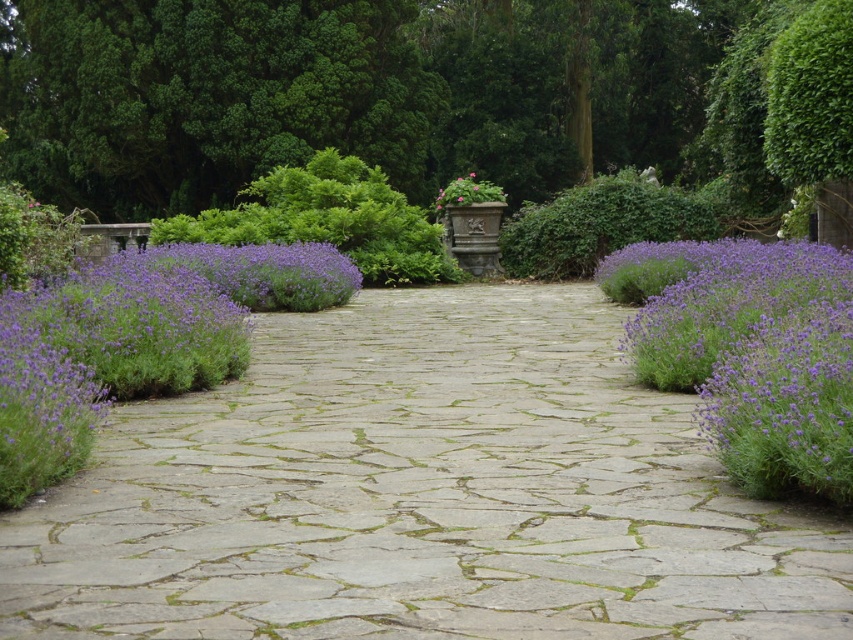
You are a gardener who needs to place a new decorative item along the garden path. The natural stone path at center and the pink matte flower pot at center are both in your view. Which object is shorter in height?

The natural stone path at center is not as tall as the pink matte flower pot at center, so the natural stone path at center is shorter in height.

From the picture: You are a gardener planning to walk along the natural stone path at center. As you walk forward, will the purple soft lavender at right become closer or farther away from you?

The natural stone path at center is in front of the purple soft lavender at right, so as you walk forward along the path, the lavender will appear farther away from you.

You are a gardener planning to walk along the natural stone path at center while avoiding the purple soft lavender at right. Can you walk comfortably without stepping on the lavender? Explain your reasoning based on the path width.

The natural stone path at center is wider than the purple soft lavender at right, so there is enough space to walk comfortably without stepping on the lavender.